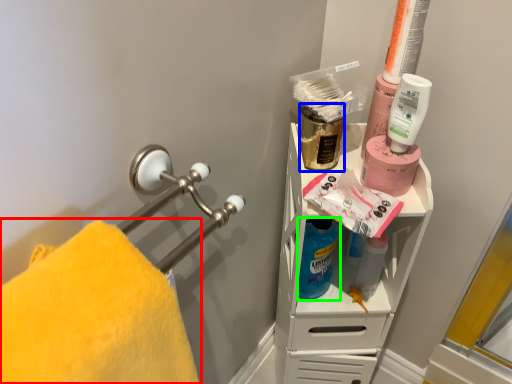
Question: Which object is positioned farthest from towel (highlighted by a red box)? Select from mouthwash (highlighted by a blue box) and cleaning product (highlighted by a green box).

Choices:
 (A) mouthwash
 (B) cleaning product

Answer: (A)